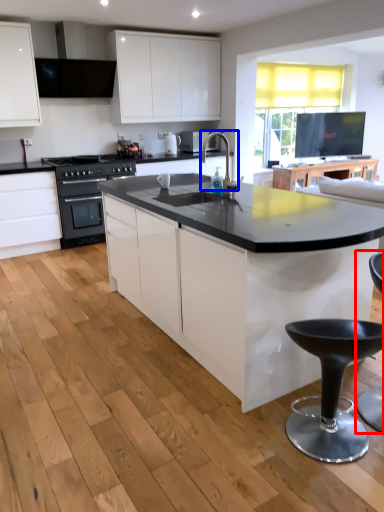
Question: Among these objects, which one is farthest to the camera, swivel chair (highlighted by a red box) or open (highlighted by a blue box)?

Choices:
 (A) swivel chair
 (B) open

Answer: (B)